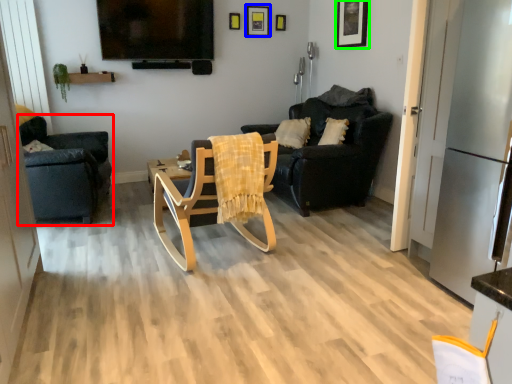
Question: Which is nearer to the chair (highlighted by a red box)? picture frame (highlighted by a blue box) or picture frame (highlighted by a green box).

Choices:
 (A) picture frame
 (B) picture frame

Answer: (A)